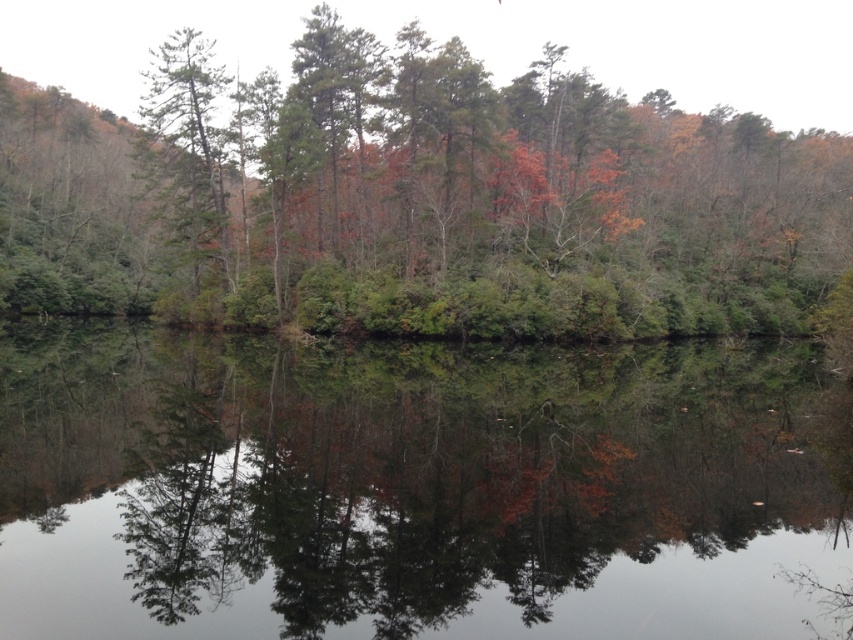
You are standing at the edge of the water and see the transparent water at center and the green matte tree at center. Which object is closer to you?

The transparent water at center is closer to you because it is positioned below the green matte tree at center, indicating it is lower in the scene.

You are standing at the origin point of the coordinate system in the scene. You want to walk directly to the green matte tree at center. In which direction should you move relative to your current position?

You should move towards the coordinates point (416, 198) to reach the green matte tree at center.